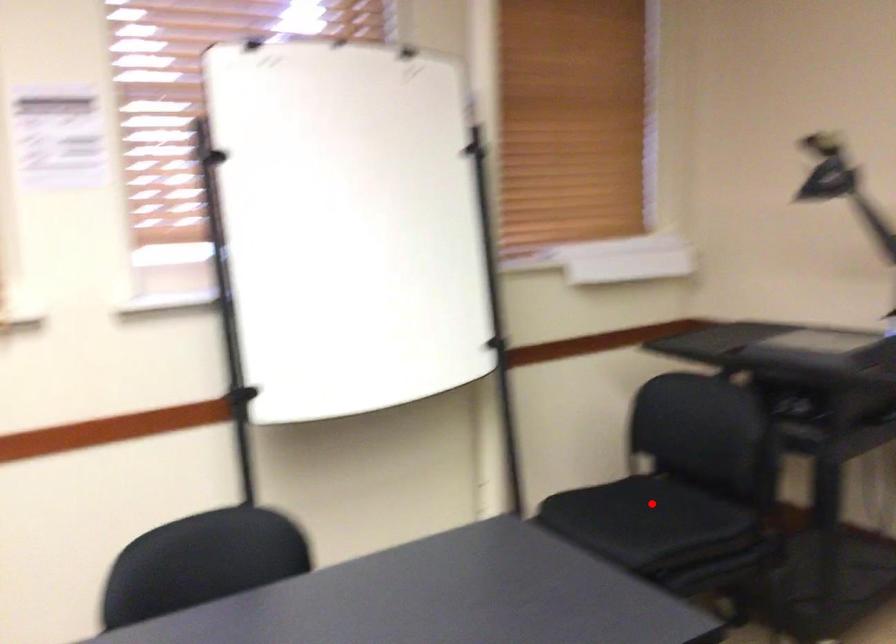
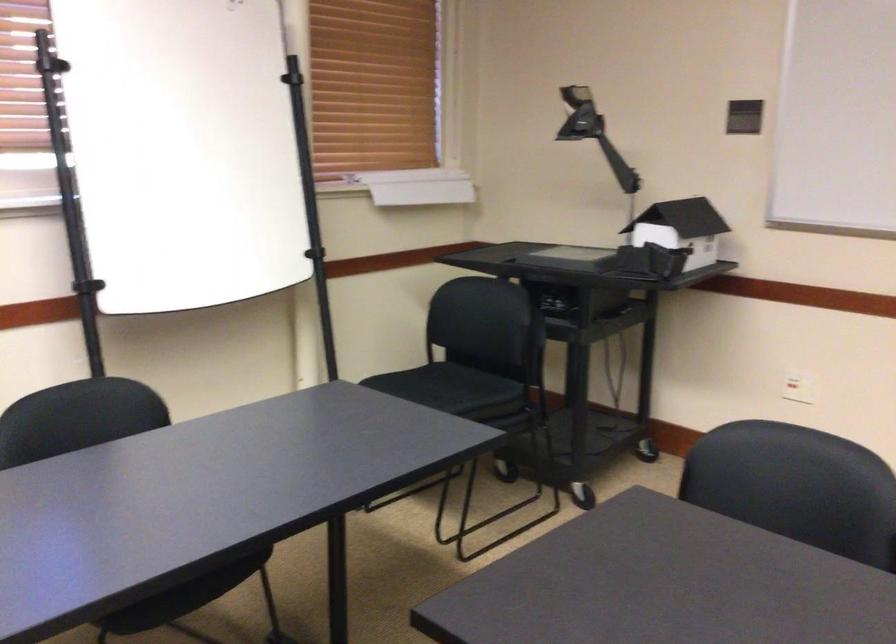
Question: A red point is marked in image1. In image2, is the corresponding 3D point closer to the camera or farther? Reply with the corresponding letter.

Choices:
 (A) The corresponding 3D point is closer.
 (B) The corresponding 3D point is farther.

Answer: (B)